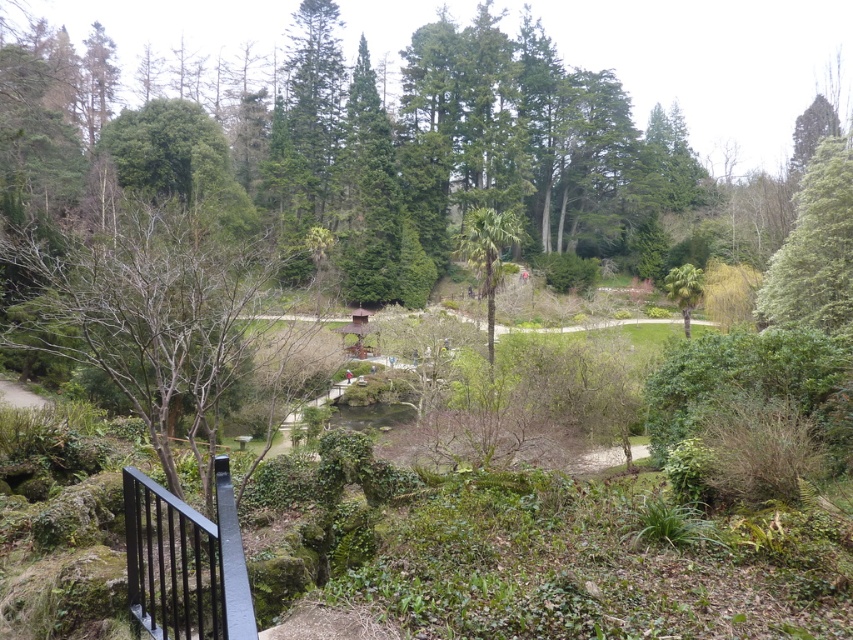
Question: Which object is closer to the camera taking this photo?

Choices:
 (A) green leafy palm tree at center
 (B) bare branches at center
 (C) green leafy tree at upper right
 (D) black metal rail at lower left

Answer: (D)

Question: Observing the image, what is the correct spatial positioning of bare branches at center in reference to green leafy tree at upper right?

Choices:
 (A) above
 (B) below

Answer: (B)

Question: Which object appears farthest from the camera in this image?

Choices:
 (A) bare branches at center
 (B) black metal rail at lower left
 (C) green leafy palm at center-right
 (D) green leafy tree at upper right

Answer: (C)

Question: Does black metal rail at lower left appear under green leafy tree at upper right?

Choices:
 (A) yes
 (B) no

Answer: (A)

Question: In this image, where is black metal rail at lower left located relative to green leafy tree at upper right?

Choices:
 (A) above
 (B) below

Answer: (B)

Question: Among these objects, which one is nearest to the camera?

Choices:
 (A) bare branches at center
 (B) green leafy palm at center-right
 (C) black metal rail at lower left
 (D) green leafy palm tree at center

Answer: (C)